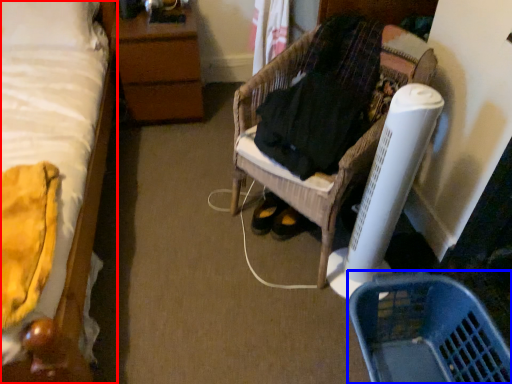
Question: Which of the following is the farthest to the observer, bed (highlighted by a red box) or basket (highlighted by a blue box)?

Choices:
 (A) bed
 (B) basket

Answer: (B)